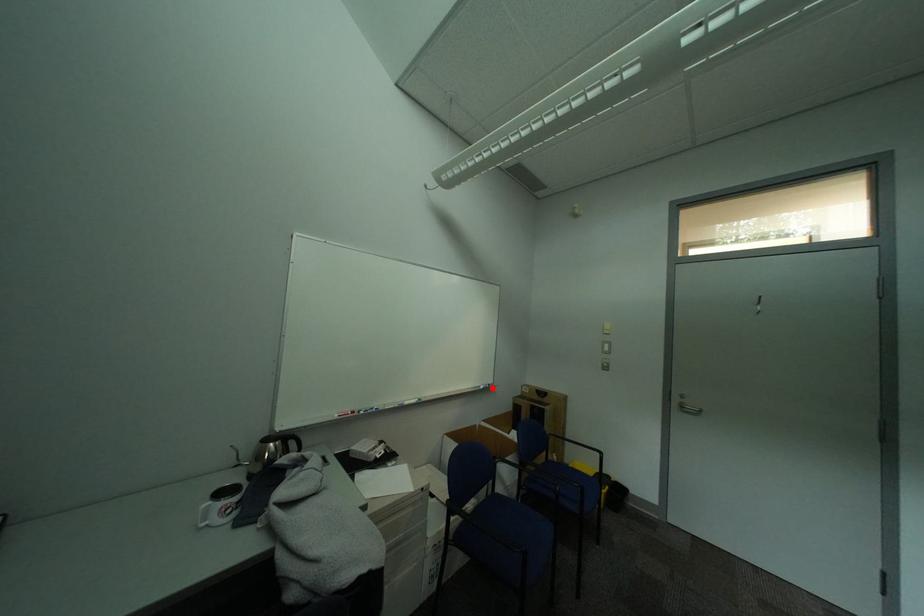
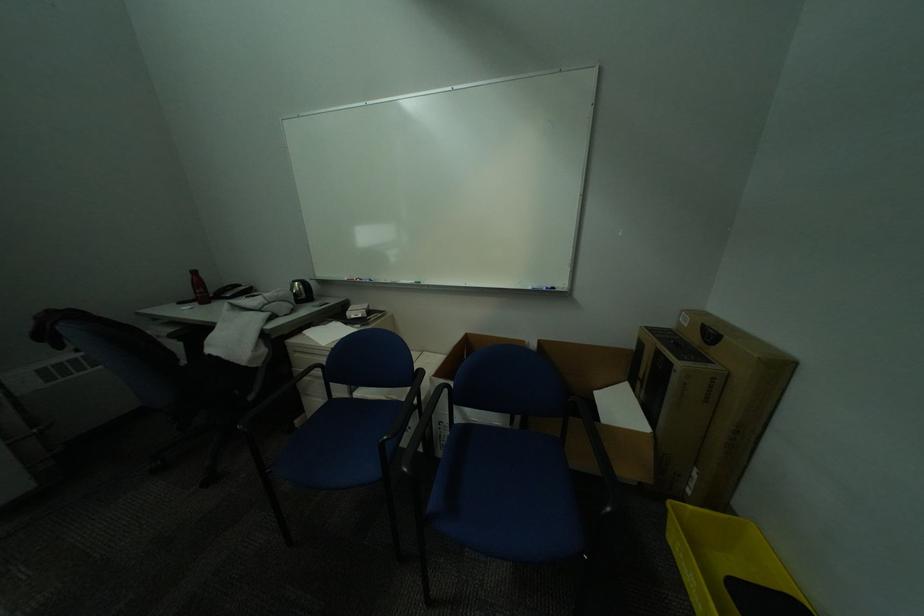
Question: I am providing you with two images of the same scene from different viewpoints. Image1 has a red point marked. In image2, the corresponding 3D location appears at what relative position? Reply with the corresponding letter.

Choices:
 (A) Closer
 (B) Farther

Answer: (A)